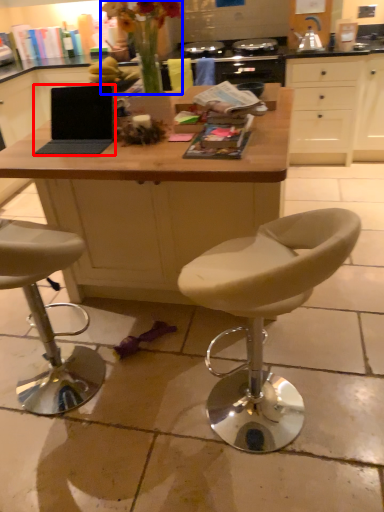
Question: Which object appears closest to the camera in this image, laptop (highlighted by a red box) or floral arrangement (highlighted by a blue box)?

Choices:
 (A) laptop
 (B) floral arrangement

Answer: (B)